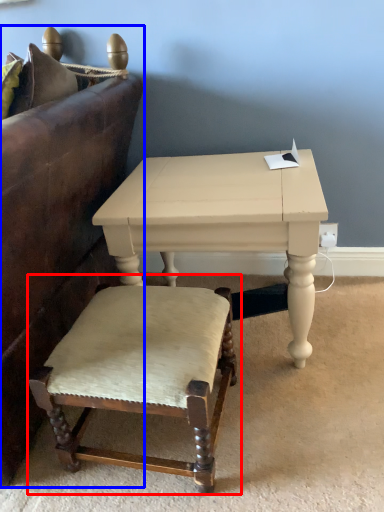
Question: Which object appears closest to the camera in this image, chair (highlighted by a red box) or studio couch (highlighted by a blue box)?

Choices:
 (A) chair
 (B) studio couch

Answer: (B)